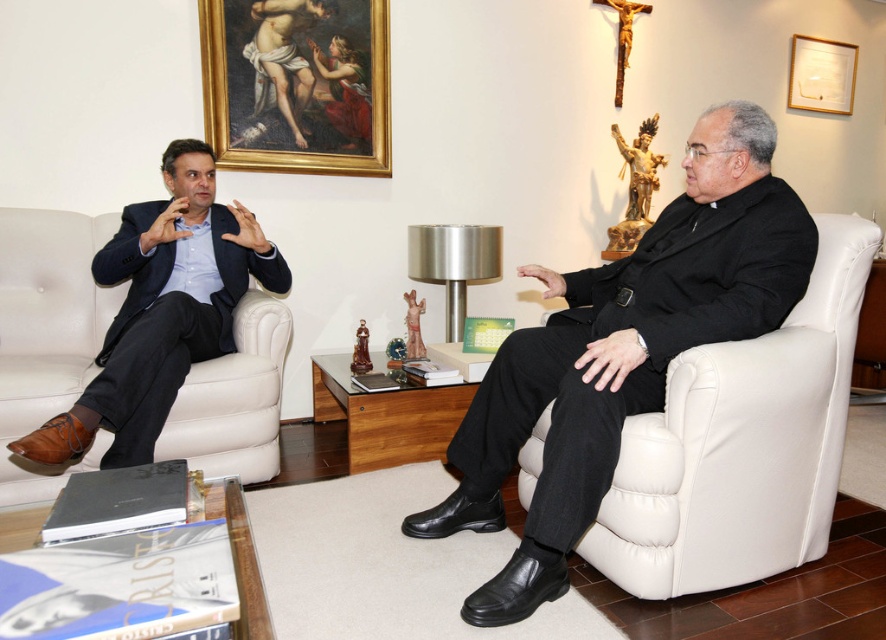
You are standing at the entrance of the room and want to sit down in the white leather armchair at right. Based on the coordinates provided, is the chair positioned closer to the wall or the center of the room?

The white leather armchair at right is located at point 0.695 on the x and 0.837 on the y axis. Since both coordinates are closer to 1, it means the chair is positioned closer to the wall rather than the center of the room.